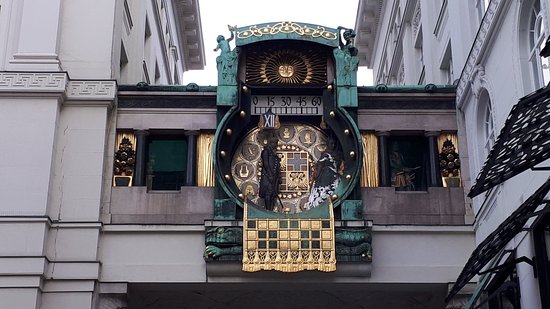
Image resolution: width=550 pixels, height=309 pixels. I want to click on window, so click(169, 171), click(407, 165).